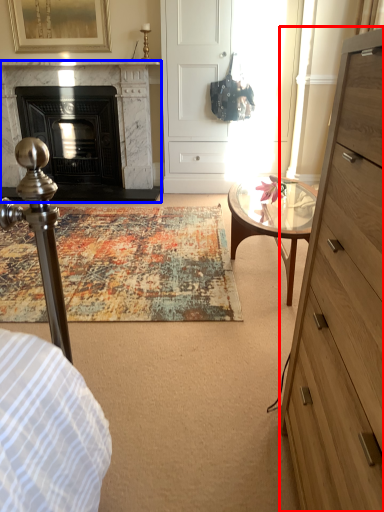
Question: Which object appears closest to the camera in this image, chest of drawers (highlighted by a red box) or fireplace (highlighted by a blue box)?

Choices:
 (A) chest of drawers
 (B) fireplace

Answer: (A)